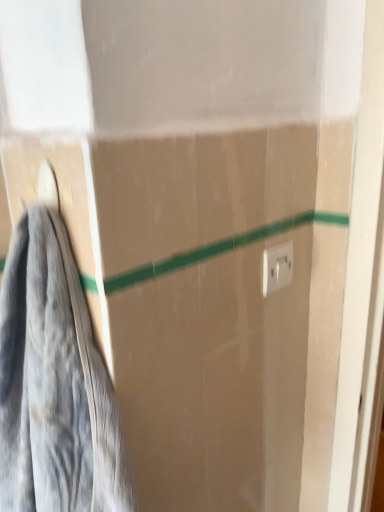
Question: Could you tell me if white plastic electric outlet at upper right is turned towards gray fabric towel at left?

Choices:
 (A) no
 (B) yes

Answer: (A)

Question: From a real-world perspective, does white plastic electric outlet at upper right stand above gray fabric towel at left?

Choices:
 (A) yes
 (B) no

Answer: (A)

Question: Is white plastic electric outlet at upper right beside gray fabric towel at left?

Choices:
 (A) yes
 (B) no

Answer: (B)

Question: Is white plastic electric outlet at upper right positioned before gray fabric towel at left?

Choices:
 (A) yes
 (B) no

Answer: (B)

Question: Is white plastic electric outlet at upper right located outside gray fabric towel at left?

Choices:
 (A) yes
 (B) no

Answer: (A)

Question: Is white plastic electric outlet at upper right thinner than gray fabric towel at left?

Choices:
 (A) no
 (B) yes

Answer: (B)

Question: Does gray fabric towel at left appear on the left side of white plastic electric outlet at upper right?

Choices:
 (A) yes
 (B) no

Answer: (A)

Question: From a real-world perspective, is gray fabric towel at left physically below white plastic electric outlet at upper right?

Choices:
 (A) no
 (B) yes

Answer: (B)

Question: Does gray fabric towel at left have a larger size compared to white plastic electric outlet at upper right?

Choices:
 (A) yes
 (B) no

Answer: (A)

Question: From the image's perspective, is gray fabric towel at left on top of white plastic electric outlet at upper right?

Choices:
 (A) yes
 (B) no

Answer: (B)

Question: Can you confirm if gray fabric towel at left is wider than white plastic electric outlet at upper right?

Choices:
 (A) no
 (B) yes

Answer: (B)

Question: Does gray fabric towel at left contain white plastic electric outlet at upper right?

Choices:
 (A) no
 (B) yes

Answer: (A)

Question: From the image's perspective, is gray fabric towel at left positioned above or below white plastic electric outlet at upper right?

Choices:
 (A) above
 (B) below

Answer: (B)